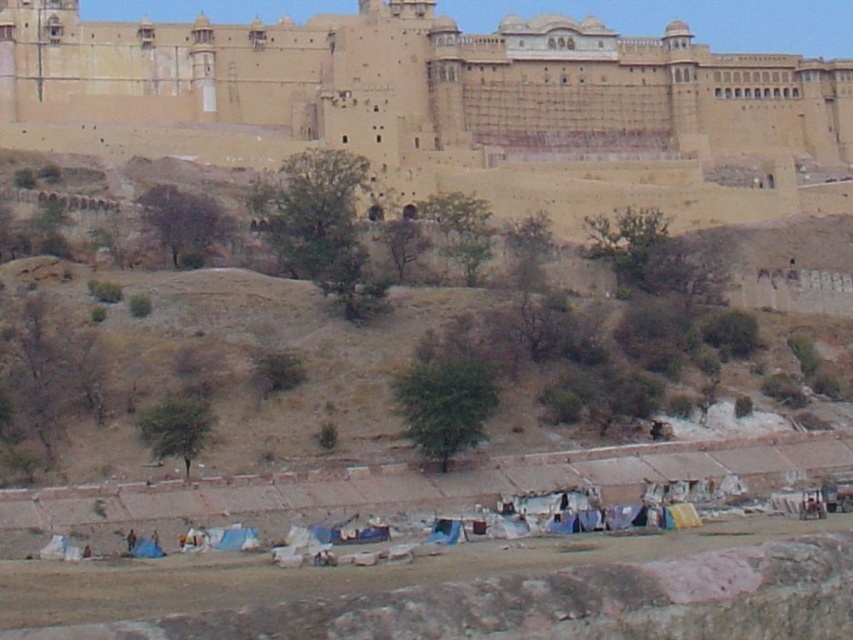
Image resolution: width=853 pixels, height=640 pixels. Describe the element at coordinates (364, 355) in the screenshot. I see `brown earthy hillside at center` at that location.

Is point (53, 298) positioned behind point (726, 129)?

No, it is in front of (726, 129).

This screenshot has width=853, height=640. What are the coordinates of `brown earthy hillside at center` in the screenshot? It's located at (364, 355).

Image resolution: width=853 pixels, height=640 pixels. Identify the location of brown earthy hillside at center. (364, 355).